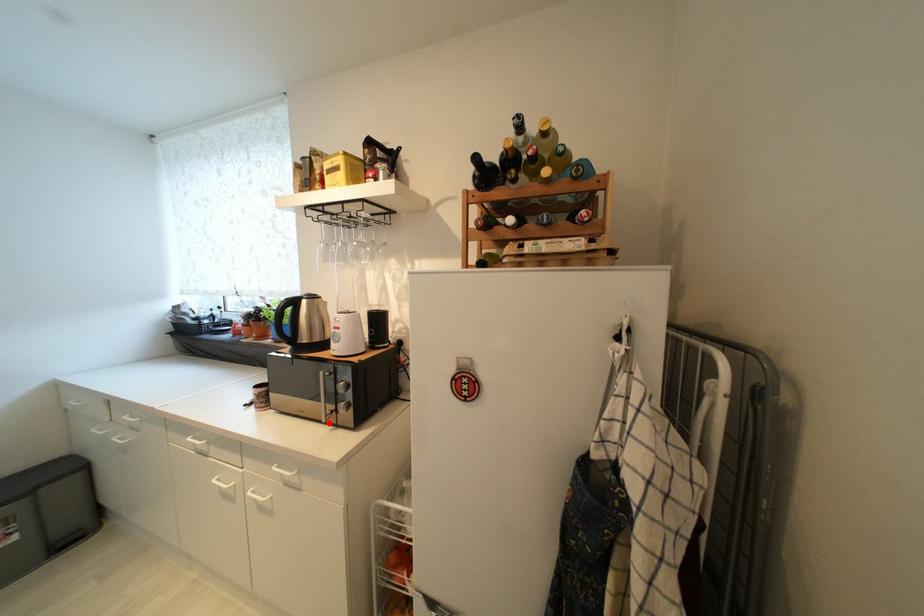
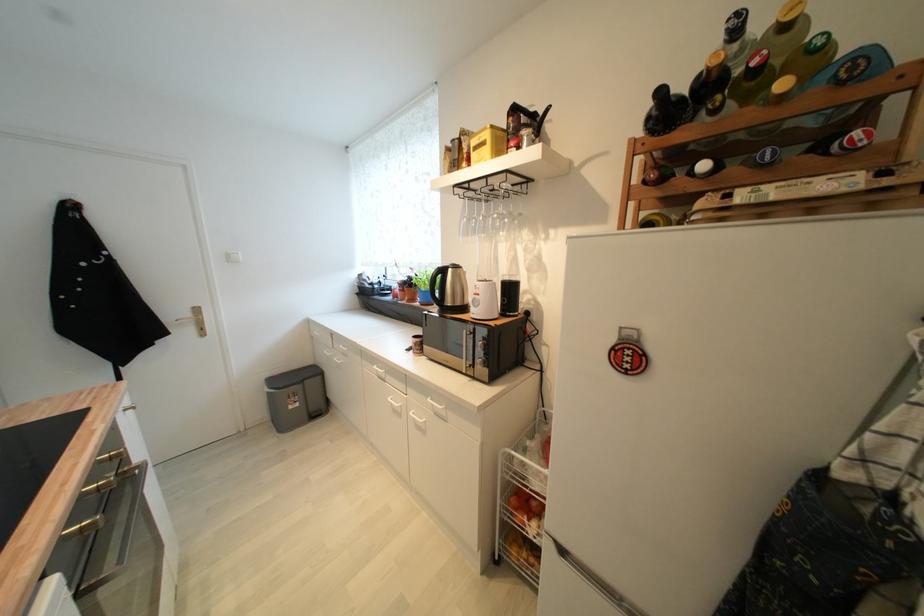
Where in the second image is the point corresponding to the highlighted location from the first image?

(469, 374)